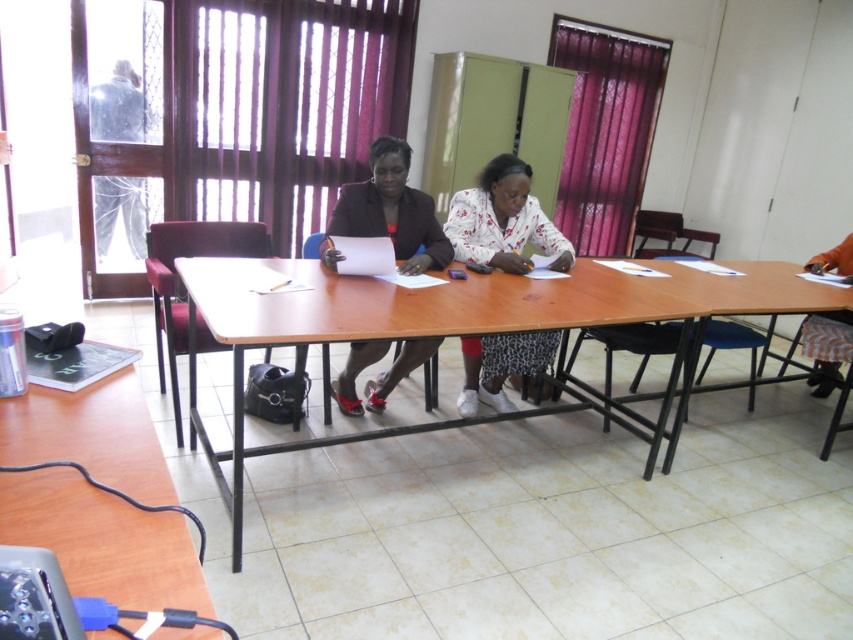
Question: Which is farther from the white printed dress at center?

Choices:
 (A) matte black skirt at center
 (B) brown wooden table at lower left
 (C) brown wooden table at center
 (D) orange fabric chair at right

Answer: (B)

Question: Which point is farther to the camera?

Choices:
 (A) (846, 262)
 (B) (71, 588)

Answer: (A)

Question: Which object is farther from the camera taking this photo?

Choices:
 (A) white printed dress at center
 (B) matte black skirt at center
 (C) orange fabric chair at right
 (D) brown wooden table at lower left

Answer: (C)

Question: Can you confirm if brown wooden table at lower left is wider than matte black skirt at center?

Choices:
 (A) yes
 (B) no

Answer: (A)

Question: Does brown wooden table at center appear on the left side of matte black skirt at center?

Choices:
 (A) no
 (B) yes

Answer: (A)

Question: Is brown wooden table at center above orange fabric chair at right?

Choices:
 (A) no
 (B) yes

Answer: (A)